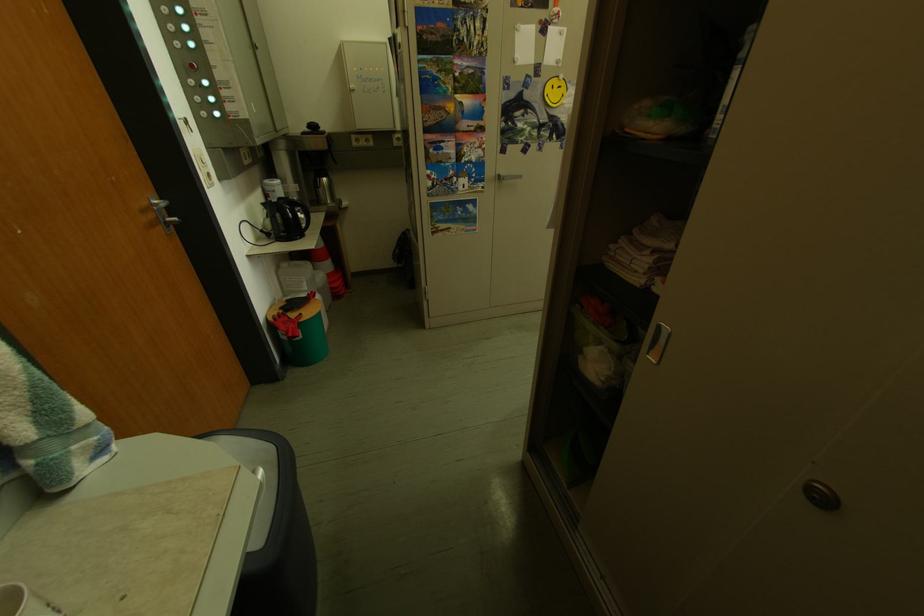
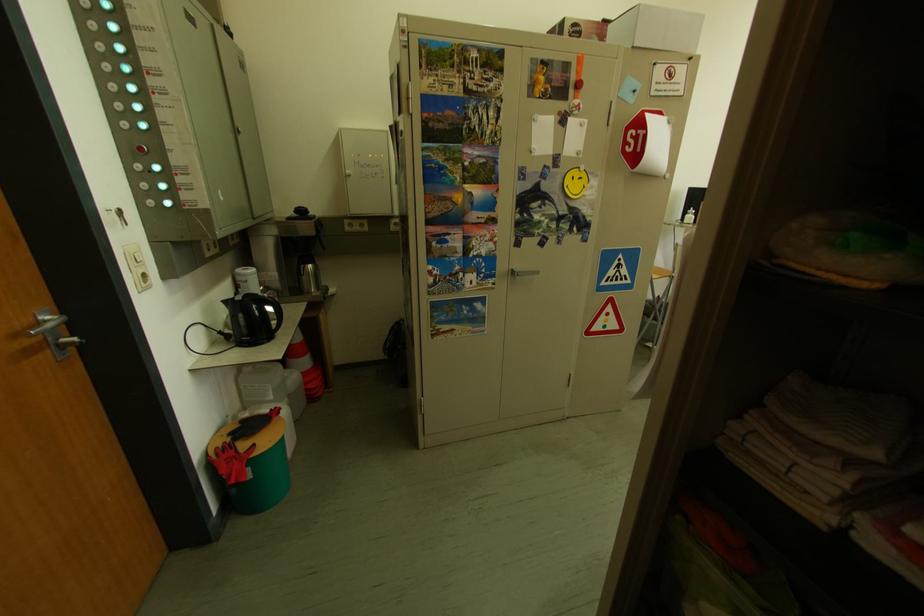
Question: The first image is from the beginning of the video and the second image is from the end. How did the camera likely rotate when shooting the video?

Choices:
 (A) Left
 (B) Right
 (C) Up
 (D) Down

Answer: (C)